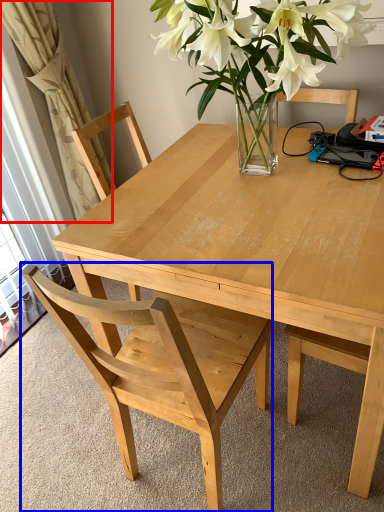
Question: Which point is further to the camera, curtain (highlighted by a red box) or chair (highlighted by a blue box)?

Choices:
 (A) curtain
 (B) chair

Answer: (A)